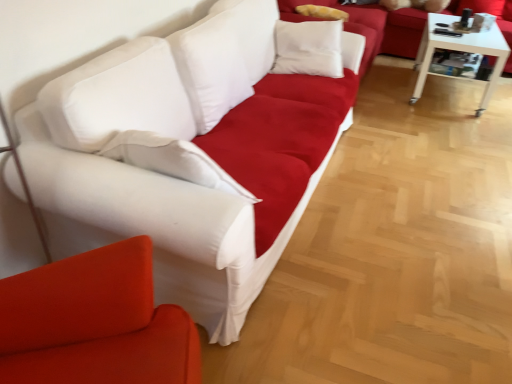
What do you see at coordinates (345, 24) in the screenshot? The width and height of the screenshot is (512, 384). I see `matte white couch at upper center` at bounding box center [345, 24].

Measure the distance between white fabric couch at left, which is the third studio couch from back to front, and camera.

The depth of white fabric couch at left, which is the third studio couch from back to front, is 98.53 centimeters.

Locate an element on the screen. Image resolution: width=512 pixels, height=384 pixels. white fabric studio couch at upper center, the first studio couch viewed from the back is located at coordinates (375, 24).

Image resolution: width=512 pixels, height=384 pixels. I want to click on matte white couch at upper center, so click(345, 24).

From a real-world perspective, relative to matte white couch at upper center, is white fabric studio couch at upper center, the first studio couch viewed from the back, vertically above or below?

Clearly, from a real-world perspective, white fabric studio couch at upper center, the first studio couch viewed from the back, is below matte white couch at upper center.

From the picture: From the image's perspective, does white fabric studio couch at upper center, the first studio couch viewed from the back, appear higher than matte white couch at upper center?

Yes, from the image's perspective, white fabric studio couch at upper center, the first studio couch viewed from the back, is on top of matte white couch at upper center.

Is white fabric studio couch at upper center, the first studio couch viewed from the back, touching matte white couch at upper center?

white fabric studio couch at upper center, the first studio couch viewed from the back, is not next to matte white couch at upper center, and they're not touching.

Measure the distance between white fabric studio couch at upper center, the first studio couch viewed from the back, and matte white couch at upper center.

A distance of 78.92 centimeters exists between white fabric studio couch at upper center, the first studio couch viewed from the back, and matte white couch at upper center.

Is white glossy table at right thinner than white fabric studio couch at upper center, the first studio couch viewed from the back?

Correct, the width of white glossy table at right is less than that of white fabric studio couch at upper center, the first studio couch viewed from the back.

Could you tell me if white glossy table at right is turned towards white fabric studio couch at upper center, which appears as the 3th studio couch when viewed from the front?

No, white glossy table at right is not oriented towards white fabric studio couch at upper center, which appears as the 3th studio couch when viewed from the front.

From a real-world perspective, between white glossy table at right and white fabric studio couch at upper center, which appears as the 3th studio couch when viewed from the front, who is vertically lower?

white glossy table at right is physically lower.

From the image's perspective, is white glossy table at right under white fabric studio couch at upper center, which appears as the 3th studio couch when viewed from the front?

Yes, from the image's perspective, white glossy table at right is below white fabric studio couch at upper center, which appears as the 3th studio couch when viewed from the front.

Is matte white couch at upper center surrounding white fabric couch at left, the 1th studio couch positioned from the front?

That's incorrect, white fabric couch at left, the 1th studio couch positioned from the front, is not inside matte white couch at upper center.

Based on the photo, which object is positioned more to the left, matte white couch at upper center or white fabric couch at left, which is the third studio couch from back to front?

Positioned to the left is white fabric couch at left, which is the third studio couch from back to front.

From the image's perspective, would you say white fabric studio couch at upper center, the first studio couch viewed from the back, is shown under white glossy table at right?

No, from the image's perspective, white fabric studio couch at upper center, the first studio couch viewed from the back, is not beneath white glossy table at right.

Looking at their sizes, would you say white fabric studio couch at upper center, which appears as the 3th studio couch when viewed from the front, is wider or thinner than white glossy table at right?

In the image, white fabric studio couch at upper center, which appears as the 3th studio couch when viewed from the front, appears to be wider than white glossy table at right.

Looking at this image, does white fabric studio couch at upper center, which appears as the 3th studio couch when viewed from the front, turn towards white glossy table at right?

No, white fabric studio couch at upper center, which appears as the 3th studio couch when viewed from the front, is not aimed at white glossy table at right.

From a real-world perspective, is white fabric studio couch at upper center, the first studio couch viewed from the back, positioned under white glossy table at right based on gravity?

Actually, white fabric studio couch at upper center, the first studio couch viewed from the back, is physically above white glossy table at right in the real world.

Based on the photo, does white fabric studio couch at upper center, the first studio couch viewed from the back, have a greater height compared to white fabric couch at left, which is the third studio couch from back to front?

Incorrect, the height of white fabric studio couch at upper center, the first studio couch viewed from the back, is not larger of that of white fabric couch at left, which is the third studio couch from back to front.

Is white fabric studio couch at upper center, the first studio couch viewed from the back, oriented towards white fabric couch at left, which is the third studio couch from back to front?

No, white fabric studio couch at upper center, the first studio couch viewed from the back, is not aimed at white fabric couch at left, which is the third studio couch from back to front.

Considering the sizes of objects white fabric studio couch at upper center, the first studio couch viewed from the back, and white fabric couch at left, which is the third studio couch from back to front, in the image provided, who is thinner, white fabric studio couch at upper center, the first studio couch viewed from the back, or white fabric couch at left, which is the third studio couch from back to front,?

Thinner between the two is white fabric couch at left, which is the third studio couch from back to front.

Which is behind, white fabric studio couch at upper center, which appears as the 3th studio couch when viewed from the front, or white fabric couch at left, which is the third studio couch from back to front?

white fabric studio couch at upper center, which appears as the 3th studio couch when viewed from the front, is behind.

Image resolution: width=512 pixels, height=384 pixels. I want to click on table behind the matte white couch at upper center, so click(460, 50).

Is white glossy table at right smaller than matte white couch at upper center?

Indeed, white glossy table at right has a smaller size compared to matte white couch at upper center.

From a real-world perspective, is white glossy table at right above or below matte white couch at upper center?

white glossy table at right is below matte white couch at upper center.

From the image's perspective, is white glossy table at right located above or below matte white couch at upper center?

white glossy table at right is situated lower than matte white couch at upper center in the image.

Find the location of a particular element. This screenshot has width=512, height=384. the 2nd studio couch positioned above the white fabric studio couch at upper center, the first studio couch viewed from the back (from a real-world perspective) is located at coordinates (95, 322).

Are white fabric couch at left, which is the third studio couch from back to front, and white fabric studio couch at upper center, which appears as the 3th studio couch when viewed from the front, located far from each other?

Yes, white fabric couch at left, which is the third studio couch from back to front, and white fabric studio couch at upper center, which appears as the 3th studio couch when viewed from the front, are quite far apart.

From a real-world perspective, is white fabric couch at left, which is the third studio couch from back to front, positioned under white fabric studio couch at upper center, which appears as the 3th studio couch when viewed from the front, based on gravity?

No, from a real-world perspective, white fabric couch at left, which is the third studio couch from back to front, is not under white fabric studio couch at upper center, which appears as the 3th studio couch when viewed from the front.

Considering the relative sizes of white fabric couch at left, the 1th studio couch positioned from the front, and white fabric studio couch at upper center, the first studio couch viewed from the back, in the image provided, is white fabric couch at left, the 1th studio couch positioned from the front, thinner than white fabric studio couch at upper center, the first studio couch viewed from the back,?

Yes, white fabric couch at left, the 1th studio couch positioned from the front, is thinner than white fabric studio couch at upper center, the first studio couch viewed from the back.

I want to click on couch that appears on the left of white fabric studio couch at upper center, the first studio couch viewed from the back, so click(x=345, y=24).

What are the coordinates of `studio couch located above the white glossy table at right (from the image's perspective)` in the screenshot? It's located at (375, 24).

From the image, which object appears to be farther from white fabric couch at center, the second studio couch when ordered from back to front, white fabric studio couch at upper center, which appears as the 3th studio couch when viewed from the front, or white fabric couch at left, the 1th studio couch positioned from the front?

Based on the image, white fabric studio couch at upper center, which appears as the 3th studio couch when viewed from the front, appears to be further to white fabric couch at center, the second studio couch when ordered from back to front.

Estimate the real-world distances between objects in this image. Which object is closer to white glossy table at right, matte white couch at upper center or white fabric studio couch at upper center, the first studio couch viewed from the back?

white fabric studio couch at upper center, the first studio couch viewed from the back.

Looking at the image, which one is located closer to matte white couch at upper center, white fabric couch at left, the 1th studio couch positioned from the front, or white glossy table at right?

white glossy table at right lies closer to matte white couch at upper center than the other object.

Consider the image. Which object lies nearer to the anchor point white glossy table at right, white fabric couch at center, the second studio couch when ordered from back to front, or matte white couch at upper center?

Based on the image, matte white couch at upper center appears to be nearer to white glossy table at right.

Considering their positions, is white fabric studio couch at upper center, which appears as the 3th studio couch when viewed from the front, positioned closer to white glossy table at right than matte white couch at upper center?

The object closer to white glossy table at right is white fabric studio couch at upper center, which appears as the 3th studio couch when viewed from the front.

When comparing their distances from matte white couch at upper center, does white fabric studio couch at upper center, the first studio couch viewed from the back, or white fabric couch at center, positioned as the second studio couch in front-to-back order, seem closer?

white fabric studio couch at upper center, the first studio couch viewed from the back, is closer to matte white couch at upper center.

From the image, which object appears to be nearer to white fabric couch at left, which is the third studio couch from back to front, white fabric studio couch at upper center, which appears as the 3th studio couch when viewed from the front, or white fabric couch at center, the second studio couch when ordered from back to front?

Among the two, white fabric couch at center, the second studio couch when ordered from back to front, is located nearer to white fabric couch at left, which is the third studio couch from back to front.

Estimate the real-world distances between objects in this image. Which object is closer to matte white couch at upper center, white fabric couch at center, the second studio couch when ordered from back to front, or white fabric studio couch at upper center, the first studio couch viewed from the back?

white fabric studio couch at upper center, the first studio couch viewed from the back, is closer to matte white couch at upper center.

Where is `studio couch between white fabric couch at left, which is the third studio couch from back to front, and matte white couch at upper center from front to back`? The height and width of the screenshot is (384, 512). studio couch between white fabric couch at left, which is the third studio couch from back to front, and matte white couch at upper center from front to back is located at coordinates (192, 153).

Find the location of a particular element. couch located between white fabric couch at left, the 1th studio couch positioned from the front, and white glossy table at right in the depth direction is located at coordinates (345, 24).

I want to click on couch between white fabric couch at center, positioned as the second studio couch in front-to-back order, and white glossy table at right from front to back, so click(x=345, y=24).

At what (x,y) coordinates should I click in order to perform the action: click on table positioned between white fabric couch at left, the 1th studio couch positioned from the front, and white fabric studio couch at upper center, which appears as the 3th studio couch when viewed from the front, from near to far. Please return your answer as a coordinate pair (x, y). Looking at the image, I should click on (460, 50).